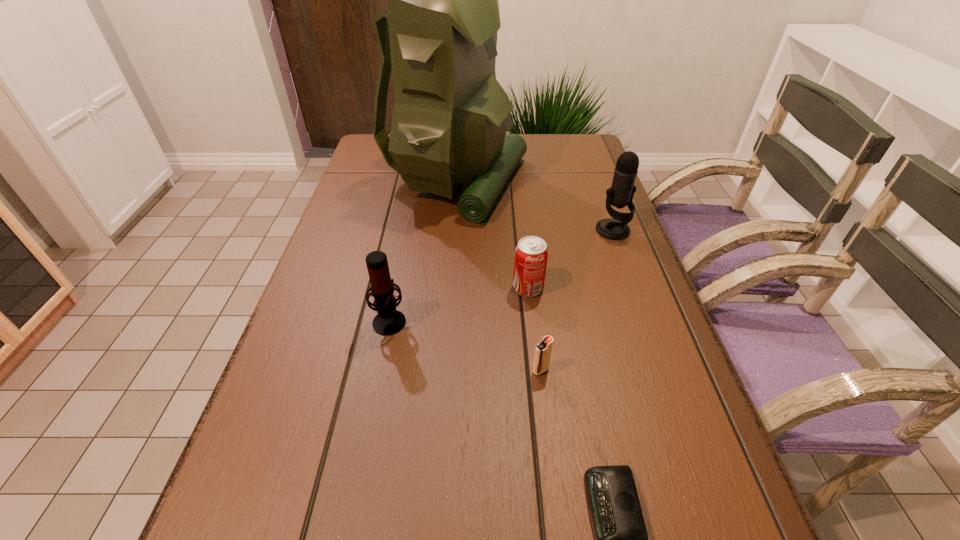
Where is `free spot located 0.140m on the back of the rightmost object`? free spot located 0.140m on the back of the rightmost object is located at coordinates (599, 191).

Where is `vacant space situated on the right of the third tallest object`? This screenshot has width=960, height=540. vacant space situated on the right of the third tallest object is located at coordinates coord(529,320).

Where is `vacant point located on the back of the fourth tallest object`? vacant point located on the back of the fourth tallest object is located at coordinates (519, 209).

Locate an element on the screen. vacant region located on the back of the igniter is located at coordinates click(x=530, y=282).

I want to click on object situated at the far edge, so click(450, 118).

In order to click on backpack at the left edge in this screenshot , I will do `click(450, 118)`.

Find the location of a particular element. The height and width of the screenshot is (540, 960). microphone positioned at the left edge is located at coordinates (388, 321).

Locate an element on the screen. The width and height of the screenshot is (960, 540). object at the right edge is located at coordinates click(621, 193).

Find the location of a particular element. The width and height of the screenshot is (960, 540). object that is at the far left corner is located at coordinates (450, 118).

I want to click on free space at the left edge of the desktop, so click(399, 193).